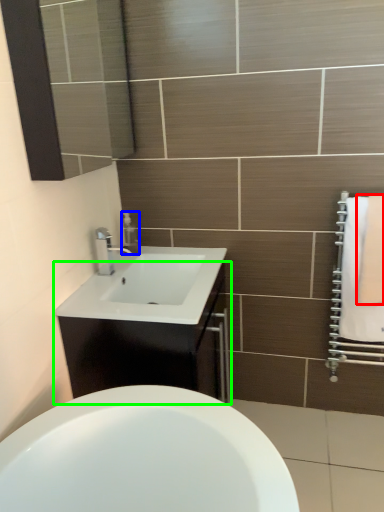
Question: Which is nearer to the bath towel (highlighted by a red box)? soap dispenser (highlighted by a blue box) or bathroom cabinet (highlighted by a green box).

Choices:
 (A) soap dispenser
 (B) bathroom cabinet

Answer: (B)